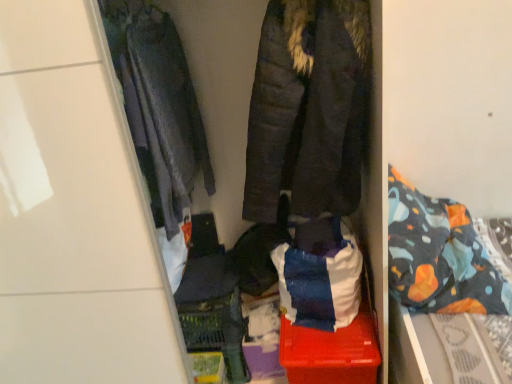
Question: Is red plastic storage box at center thinner than dark gray quilted jacket at left, which appears as the second jacket when viewed from the right?

Choices:
 (A) yes
 (B) no

Answer: (B)

Question: Can you confirm if red plastic storage box at center is wider than dark gray quilted jacket at left, the 1th jacket in the left-to-right sequence?

Choices:
 (A) yes
 (B) no

Answer: (A)

Question: Is red plastic storage box at center looking in the opposite direction of dark gray quilted jacket at left, which appears as the second jacket when viewed from the right?

Choices:
 (A) yes
 (B) no

Answer: (B)

Question: Is red plastic storage box at center not within dark gray quilted jacket at left, the 1th jacket in the left-to-right sequence?

Choices:
 (A) yes
 (B) no

Answer: (A)

Question: Can you confirm if red plastic storage box at center is smaller than dark gray quilted jacket at left, the 1th jacket in the left-to-right sequence?

Choices:
 (A) no
 (B) yes

Answer: (A)

Question: Which is correct: patterned fabric bed at right is inside dark gray quilted jacket at left, which appears as the second jacket when viewed from the right, or outside of it?

Choices:
 (A) inside
 (B) outside

Answer: (B)

Question: Considering the positions of patterned fabric bed at right and dark gray quilted jacket at left, which appears as the second jacket when viewed from the right, in the image, is patterned fabric bed at right wider or thinner than dark gray quilted jacket at left, which appears as the second jacket when viewed from the right,?

Choices:
 (A) wide
 (B) thin

Answer: (A)

Question: In terms of size, does patterned fabric bed at right appear bigger or smaller than dark gray quilted jacket at left, the 1th jacket in the left-to-right sequence?

Choices:
 (A) big
 (B) small

Answer: (A)

Question: From a real-world perspective, relative to dark gray quilted jacket at left, the 1th jacket in the left-to-right sequence, is patterned fabric bed at right vertically above or below?

Choices:
 (A) below
 (B) above

Answer: (A)

Question: Would you say red plastic storage box at center is inside or outside patterned fabric bed at right?

Choices:
 (A) inside
 (B) outside

Answer: (B)

Question: Considering the positions of red plastic storage box at center and patterned fabric bed at right in the image, is red plastic storage box at center taller or shorter than patterned fabric bed at right?

Choices:
 (A) short
 (B) tall

Answer: (A)

Question: Considering the positions of point (366, 311) and point (498, 299), is point (366, 311) closer or farther from the camera than point (498, 299)?

Choices:
 (A) farther
 (B) closer

Answer: (A)

Question: Looking at their shapes, would you say red plastic storage box at center is wider or thinner than patterned fabric bed at right?

Choices:
 (A) thin
 (B) wide

Answer: (B)

Question: Based on their positions, is dark brown quilted jacket at center, positioned as the 1th jacket in right-to-left order, located to the left or right of patterned fabric bed at right?

Choices:
 (A) left
 (B) right

Answer: (A)

Question: Is dark brown quilted jacket at center, positioned as the 1th jacket in right-to-left order, taller or shorter than patterned fabric bed at right?

Choices:
 (A) tall
 (B) short

Answer: (B)